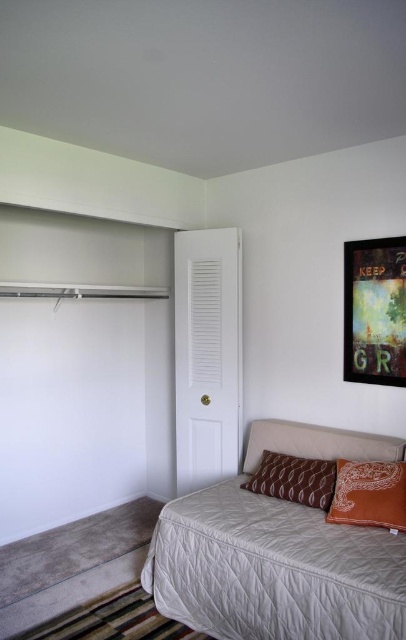
Question: Which of the following is the farthest from the observer?

Choices:
 (A) metallic framed artwork at upper right
 (B) beige quilted bed at lower right
 (C) brown patterned pillow at center

Answer: (A)

Question: Is beige quilted bed at lower right positioned before metallic framed artwork at upper right?

Choices:
 (A) yes
 (B) no

Answer: (A)

Question: Does brown textured pillow at lower right have a greater width compared to brown patterned pillow at center?

Choices:
 (A) no
 (B) yes

Answer: (A)

Question: Does brown textured pillow at lower right appear on the right side of brown patterned pillow at center?

Choices:
 (A) yes
 (B) no

Answer: (A)

Question: Which point is farther from the camera taking this photo?

Choices:
 (A) (401, 340)
 (B) (351, 518)
 (C) (313, 480)
 (D) (354, 618)

Answer: (A)

Question: Among these objects, which one is farthest from the camera?

Choices:
 (A) metallic framed artwork at upper right
 (B) brown textured pillow at lower right
 (C) brown patterned pillow at center
 (D) beige quilted bed at lower right

Answer: (A)